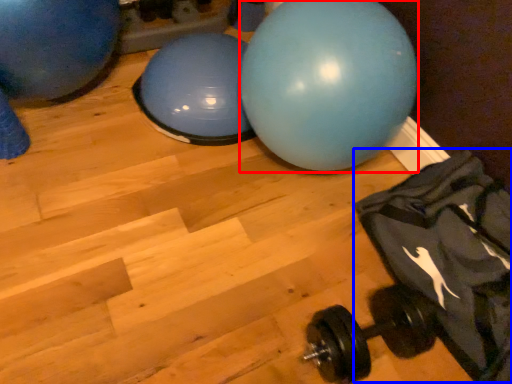
Question: Which object appears closest to the camera in this image, ball (highlighted by a red box) or bean bag chair (highlighted by a blue box)?

Choices:
 (A) ball
 (B) bean bag chair

Answer: (B)